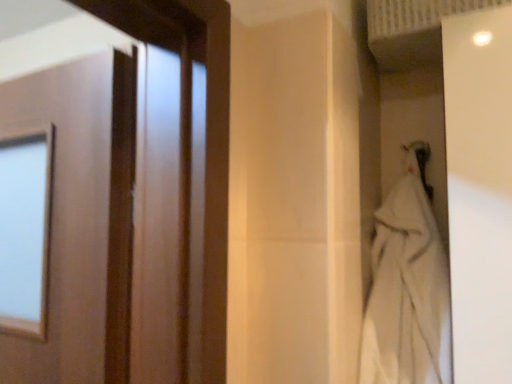
Locate an element on the screen. The height and width of the screenshot is (384, 512). white glossy screen door at right is located at coordinates (480, 190).

The height and width of the screenshot is (384, 512). What do you see at coordinates (480, 190) in the screenshot? I see `white glossy screen door at right` at bounding box center [480, 190].

I want to click on white glossy screen door at right, so click(x=480, y=190).